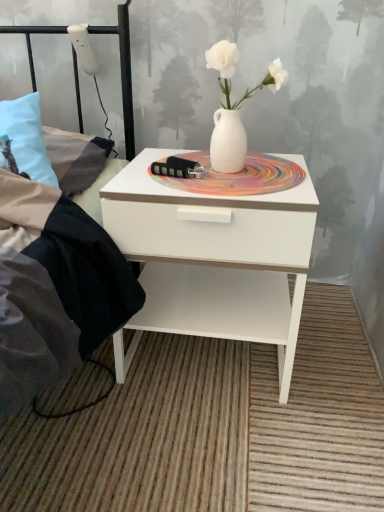
What do you see at coordinates (56, 284) in the screenshot?
I see `black metal bed frame at upper left` at bounding box center [56, 284].

Where is `black metal bed frame at upper left`? The height and width of the screenshot is (512, 384). black metal bed frame at upper left is located at coordinates [x=56, y=284].

The width and height of the screenshot is (384, 512). I want to click on white glossy nightstand at center, so click(x=213, y=260).

The width and height of the screenshot is (384, 512). Describe the element at coordinates (213, 260) in the screenshot. I see `white glossy nightstand at center` at that location.

Identify the location of black metal bed frame at upper left. (56, 284).

Would you say black metal bed frame at upper left is to the left or to the right of white glossy nightstand at center in the picture?

black metal bed frame at upper left is positioned on white glossy nightstand at center's left side.

Who is more distant, black metal bed frame at upper left or white glossy nightstand at center?

white glossy nightstand at center is more distant.

Which is farther, (18, 354) or (296, 281)?

Point (296, 281)

From the image's perspective, does black metal bed frame at upper left appear higher than white glossy nightstand at center?

Yes.

From a real-world perspective, is black metal bed frame at upper left positioned over white glossy nightstand at center based on gravity?

Yes, from a real-world perspective, black metal bed frame at upper left is above white glossy nightstand at center.

Does black metal bed frame at upper left have a greater width compared to white glossy nightstand at center?

Yes.

From their relative heights in the image, would you say black metal bed frame at upper left is taller or shorter than white glossy nightstand at center?

Considering their sizes, black metal bed frame at upper left has less height than white glossy nightstand at center.

Does black metal bed frame at upper left have a larger size compared to white glossy nightstand at center?

Indeed, black metal bed frame at upper left has a larger size compared to white glossy nightstand at center.

Is black metal bed frame at upper left inside the boundaries of white glossy nightstand at center, or outside?

black metal bed frame at upper left is not inside white glossy nightstand at center, it's outside.

Would you consider black metal bed frame at upper left to be distant from white glossy nightstand at center?

Actually, black metal bed frame at upper left and white glossy nightstand at center are a little close together.

Is black metal bed frame at upper left turned away from white glossy nightstand at center?

black metal bed frame at upper left does not have its back to white glossy nightstand at center.

Measure the distance from black metal bed frame at upper left to white glossy nightstand at center.

black metal bed frame at upper left is 25.54 centimeters away from white glossy nightstand at center.

Image resolution: width=384 pixels, height=512 pixels. In order to click on nightstand below the black metal bed frame at upper left (from a real-world perspective) in this screenshot , I will do tap(213, 260).

Is white glossy nightstand at center to the left of black metal bed frame at upper left from the viewer's perspective?

No.

Considering their positions, is white glossy nightstand at center located in front of or behind black metal bed frame at upper left?

Clearly, white glossy nightstand at center is behind black metal bed frame at upper left.

Considering the points (134, 190) and (77, 300), which point is in front, point (134, 190) or point (77, 300)?

The point (77, 300) is closer.

From the image's perspective, would you say white glossy nightstand at center is positioned over black metal bed frame at upper left?

No, from the image's perspective, white glossy nightstand at center is not above black metal bed frame at upper left.

From a real-world perspective, is white glossy nightstand at center above or below black metal bed frame at upper left?

From a real-world perspective, white glossy nightstand at center is physically below black metal bed frame at upper left.

Considering the sizes of objects white glossy nightstand at center and black metal bed frame at upper left in the image provided, who is thinner, white glossy nightstand at center or black metal bed frame at upper left?

Thinner between the two is white glossy nightstand at center.

Between white glossy nightstand at center and black metal bed frame at upper left, which one has more height?

white glossy nightstand at center is taller.

Which of these two, white glossy nightstand at center or black metal bed frame at upper left, is bigger?

black metal bed frame at upper left.

Choose the correct answer: Is white glossy nightstand at center inside black metal bed frame at upper left or outside it?

The correct answer is: outside.

Is white glossy nightstand at center in contact with black metal bed frame at upper left?

white glossy nightstand at center and black metal bed frame at upper left are clearly separated.

Could you tell me if white glossy nightstand at center is facing black metal bed frame at upper left?

No, white glossy nightstand at center is not facing towards black metal bed frame at upper left.

From the picture: How many degrees apart are the facing directions of white glossy nightstand at center and black metal bed frame at upper left?

The angle between the facing direction of white glossy nightstand at center and the facing direction of black metal bed frame at upper left is 4.67 degrees.

Identify the location of bed frame that appears on the left of white glossy nightstand at center. (56, 284).

You are a GUI agent. You are given a task and a screenshot of the screen. Output one action in this format:
    pyautogui.click(x=<x>, y=<y>)
    Task: Click on the nightstand that is behind the black metal bed frame at upper left
    The image size is (384, 512).
    Given the screenshot: What is the action you would take?
    pyautogui.click(x=213, y=260)

Image resolution: width=384 pixels, height=512 pixels. What are the coordinates of `nightstand lying below the black metal bed frame at upper left (from the image's perspective)` in the screenshot? It's located at (213, 260).